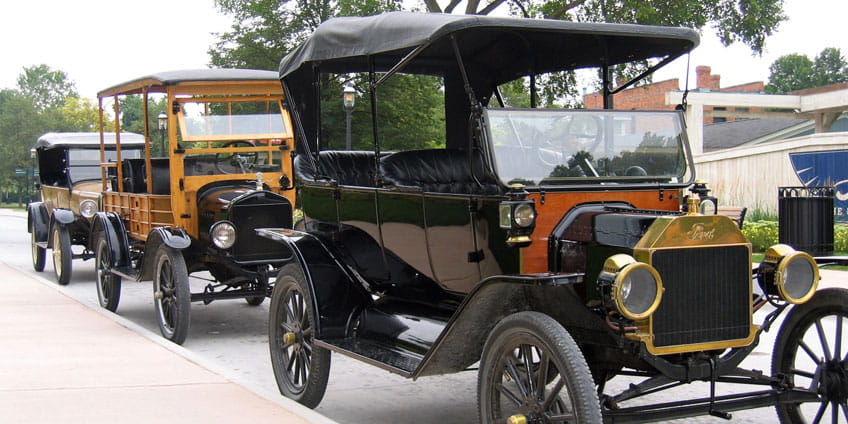
Find the location of a particular element. door is located at coordinates [x=398, y=219].